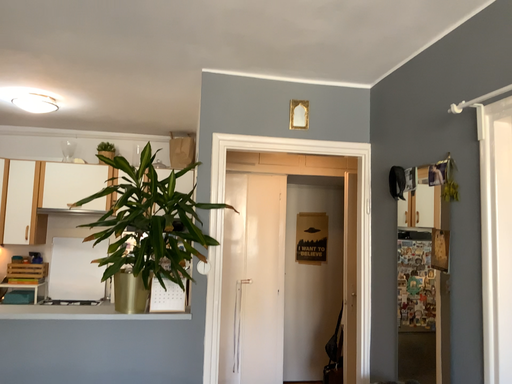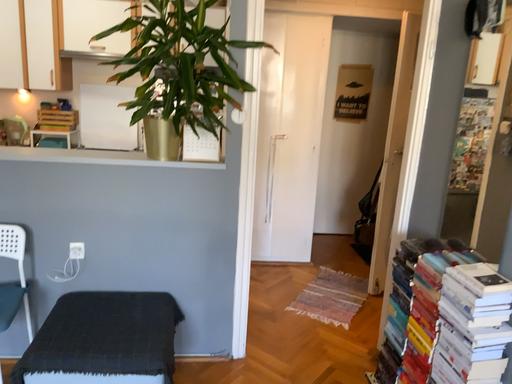
Question: Which way did the camera rotate in the video?

Choices:
 (A) rotated downward
 (B) rotated upward

Answer: (A)